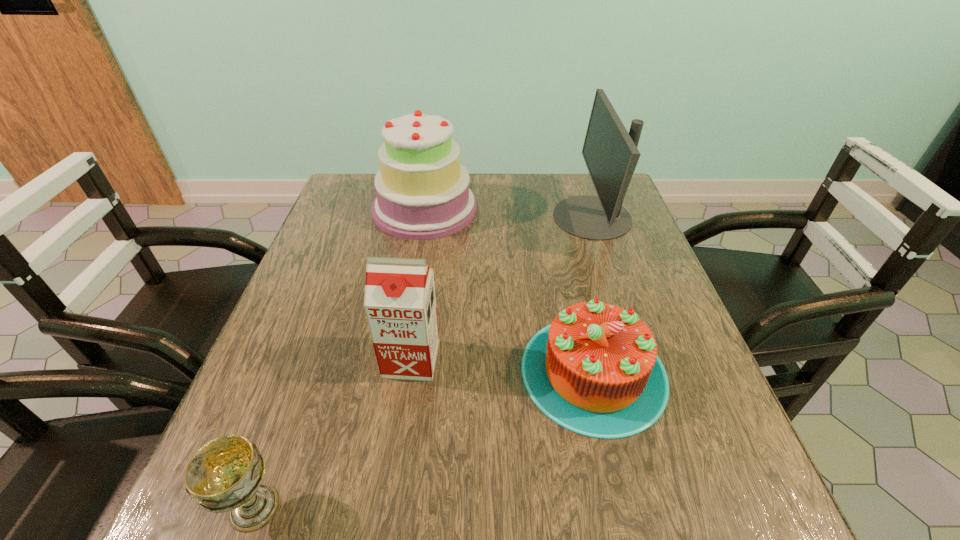
This screenshot has width=960, height=540. Find the location of `empty space between the computer monitor and the soya milk`. empty space between the computer monitor and the soya milk is located at coordinates pyautogui.click(x=502, y=288).

This screenshot has height=540, width=960. Find the location of `vacant area that lies between the nearer cake and the computer monitor`. vacant area that lies between the nearer cake and the computer monitor is located at coordinates (592, 294).

Where is `vacant point located between the taller cake and the computer monitor`? This screenshot has height=540, width=960. vacant point located between the taller cake and the computer monitor is located at coordinates (509, 213).

Identify the location of object that is the closest to the nearer cake. click(x=400, y=304).

At what (x,y) coordinates should I click in order to perform the action: click on the fourth closest object to the computer monitor. Please return your answer as a coordinate pair (x, y). Image resolution: width=960 pixels, height=540 pixels. Looking at the image, I should click on (226, 474).

Locate an element on the screen. This screenshot has width=960, height=540. vacant region that satisfies the following two spatial constraints: 1. on the screen of the computer monitor; 2. on the front side of the soya milk is located at coordinates (639, 359).